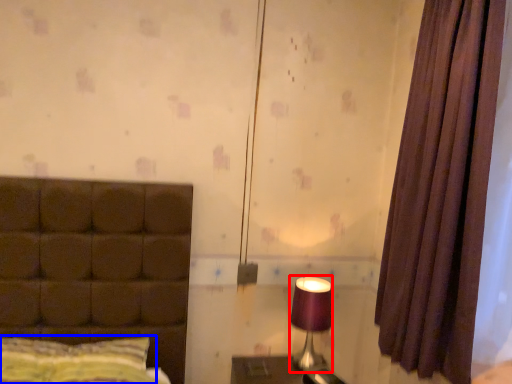
Question: Which of the following is the farthest to the observer, table lamp (highlighted by a red box) or pillow (highlighted by a blue box)?

Choices:
 (A) table lamp
 (B) pillow

Answer: (A)